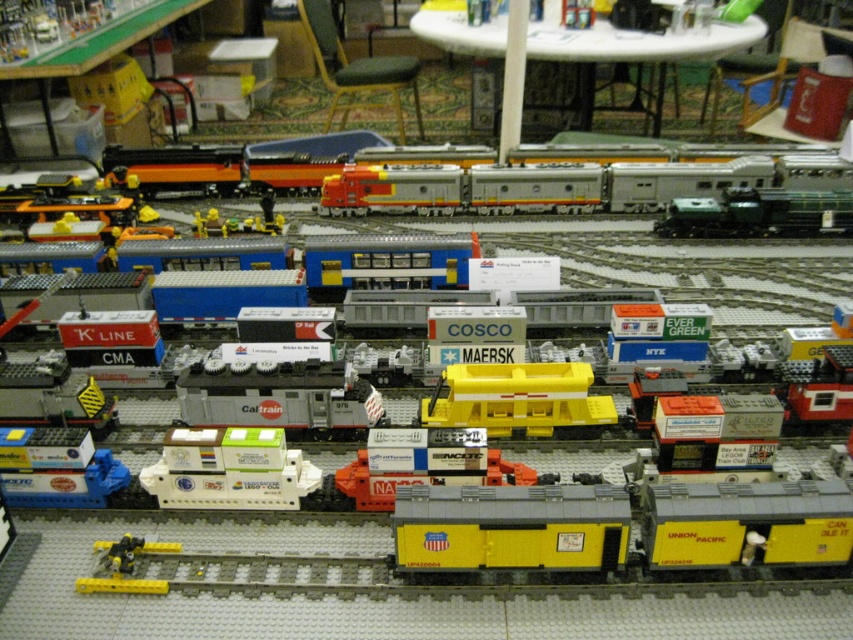
Is yellow plastic train car at center above matte gray container at center?

Correct, yellow plastic train car at center is located above matte gray container at center.

In the scene shown: Can you confirm if yellow plastic train car at center is positioned to the left of matte gray container at center?

Correct, you'll find yellow plastic train car at center to the left of matte gray container at center.

Who is more forward, (554,392) or (724,449)?

Point (724,449) is in front.

At what (x,y) coordinates should I click in order to perform the action: click on yellow plastic train car at center. Please return your answer as a coordinate pair (x, y). The width and height of the screenshot is (853, 640). Looking at the image, I should click on (515, 397).

Between metallic silver train at center and yellow plastic train car at lower left, which one is positioned lower?

yellow plastic train car at lower left

Measure the distance between metallic silver train at center and camera.

metallic silver train at center and camera are 6.00 feet apart from each other.

Between point (546, 195) and point (103, 576), which one is positioned behind?

The point (546, 195) is more distant.

Find the location of a particular element. This screenshot has width=853, height=640. metallic silver train at center is located at coordinates tap(566, 184).

Can you confirm if yellow plastic train car at center is thinner than red plastic cargo container at center right?

Incorrect, yellow plastic train car at center's width is not less than red plastic cargo container at center right's.

Is yellow plastic train car at center below red plastic cargo container at center right?

Correct, yellow plastic train car at center is located below red plastic cargo container at center right.

Where is `yellow plastic train car at center`? yellow plastic train car at center is located at coordinates [515, 397].